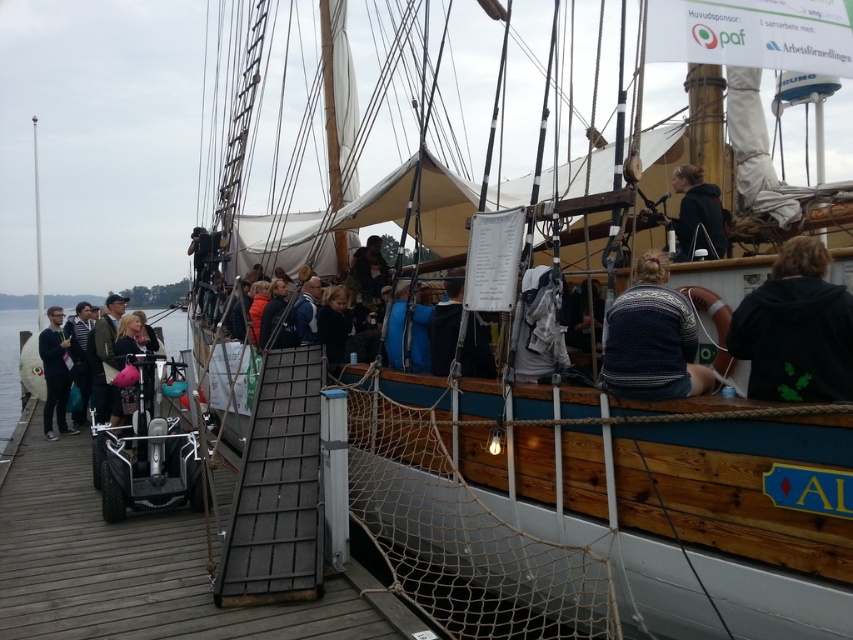
In the scene shown: You are standing on the dock and looking at the clear blue water at lower left and dark gray fabric jacket at left. Which object takes up more space in the scene?

The clear blue water at lower left takes up more space in the scene as it is larger than the dark gray fabric jacket at left.

You are standing on the dock and see the matte black jacket at left and the white wood mast at upper center. Which object is positioned higher from the ground?

The white wood mast at upper center is positioned higher from the ground than the matte black jacket at left.